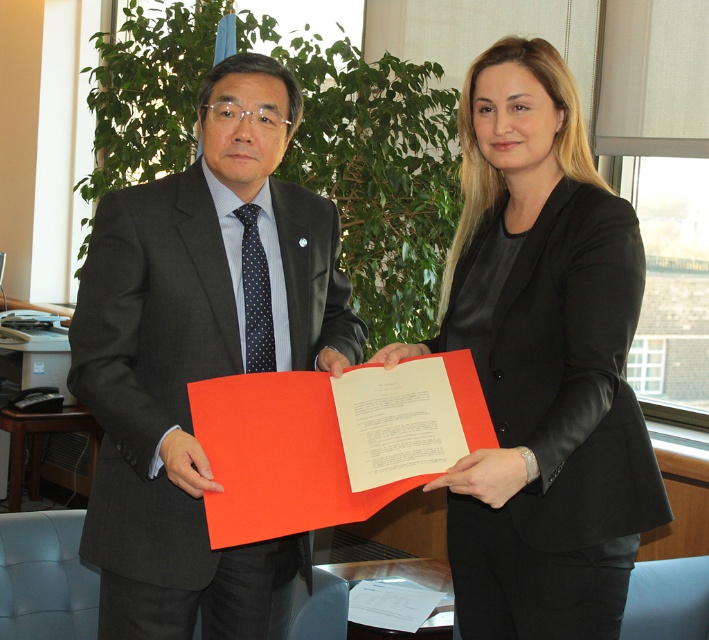
Is black leather jacket at center above matte black suit at center?

Indeed, black leather jacket at center is positioned over matte black suit at center.

Is point (519, 172) in front of point (203, 129)?

That is False.

Identify the location of black leather jacket at center. (542, 362).